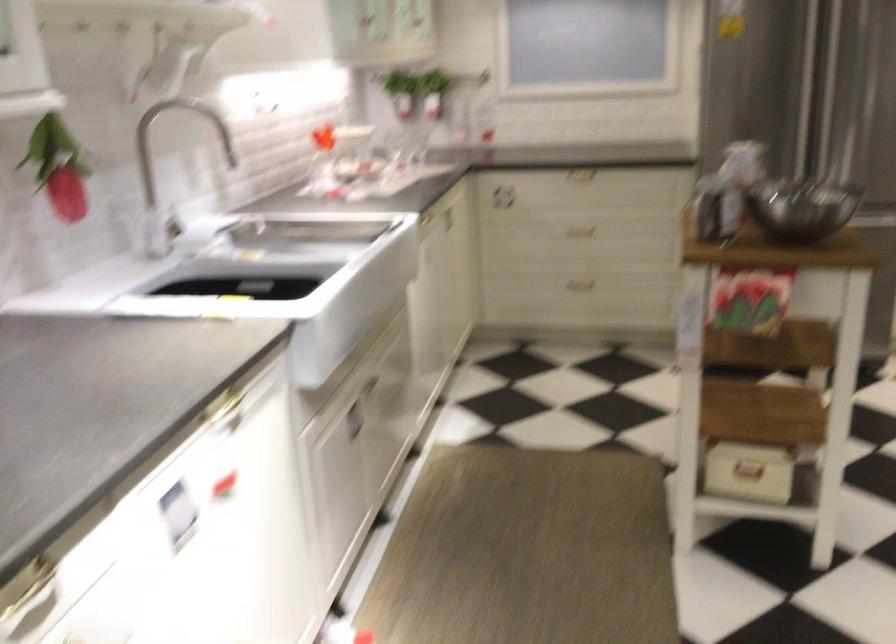
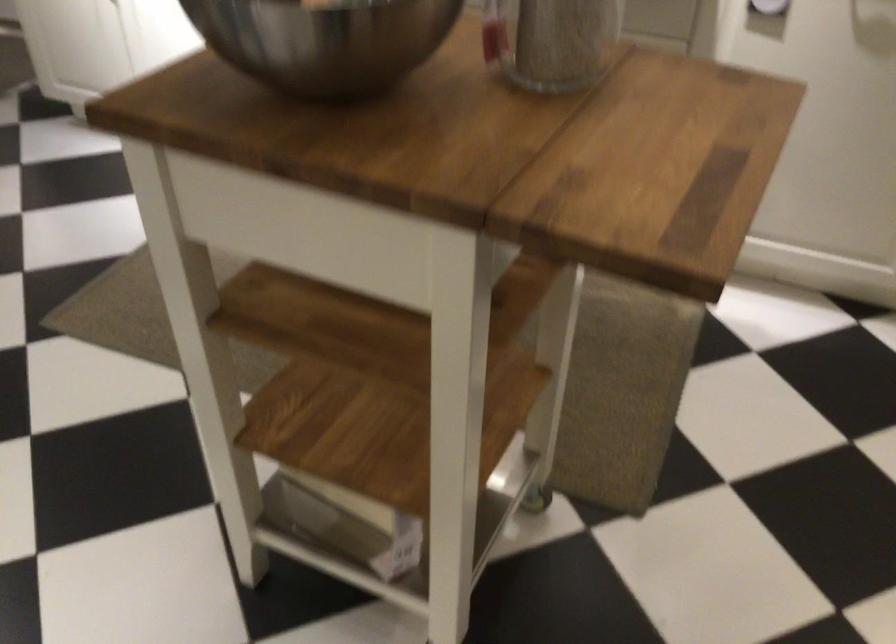
Where in the second image is the point corresponding to point (791, 468) from the first image?

(352, 524)